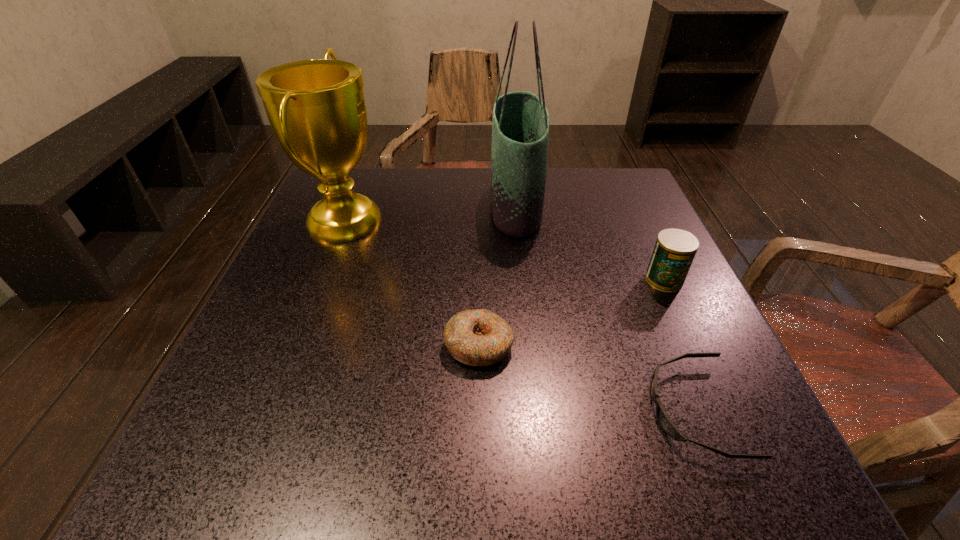
The width and height of the screenshot is (960, 540). I want to click on tote bag, so click(x=520, y=123).

The height and width of the screenshot is (540, 960). I want to click on award, so click(316, 108).

The image size is (960, 540). I want to click on the second tallest object, so pos(316,108).

The image size is (960, 540). In order to click on the third shortest object in this screenshot , I will do point(675,249).

Find the location of a particular element. doughnut is located at coordinates (476, 337).

Identify the location of sunglasses. click(x=665, y=422).

This screenshot has width=960, height=540. Identify the location of vacant region located 0.390m on the left of the tallest object. (325, 205).

Identify the location of vacant point located 0.180m on the shiny surface of the award. The height and width of the screenshot is (540, 960). (466, 219).

You are a GUI agent. You are given a task and a screenshot of the screen. Output one action in this format:
    pyautogui.click(x=<x>, y=<y>)
    Task: Click on the vacant region located 0.140m on the back of the can
    
    Given the screenshot: What is the action you would take?
    pyautogui.click(x=639, y=227)

Image resolution: width=960 pixels, height=540 pixels. I want to click on free space located 0.160m on the front of the second shortest object, so click(478, 473).